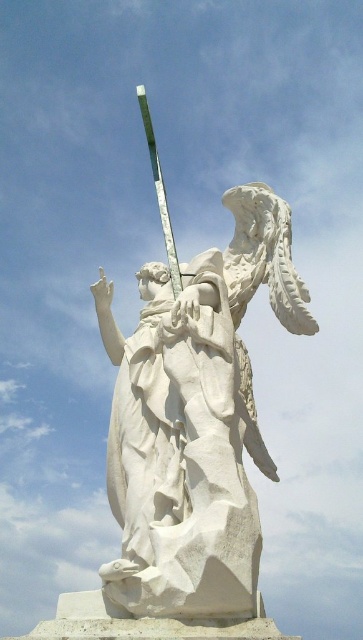
Between white marble statue at center and green glass pole at upper center, which one appears on the right side from the viewer's perspective?

From the viewer's perspective, white marble statue at center appears more on the right side.

The height and width of the screenshot is (640, 363). What do you see at coordinates (194, 420) in the screenshot? I see `white marble statue at center` at bounding box center [194, 420].

Is point (227, 486) behind point (140, 109)?

No, it is not.

You are a GUI agent. You are given a task and a screenshot of the screen. Output one action in this format:
    pyautogui.click(x=<x>, y=<y>)
    Task: Click on the white marble statue at center
    The image size is (363, 640).
    Given the screenshot: What is the action you would take?
    pyautogui.click(x=194, y=420)